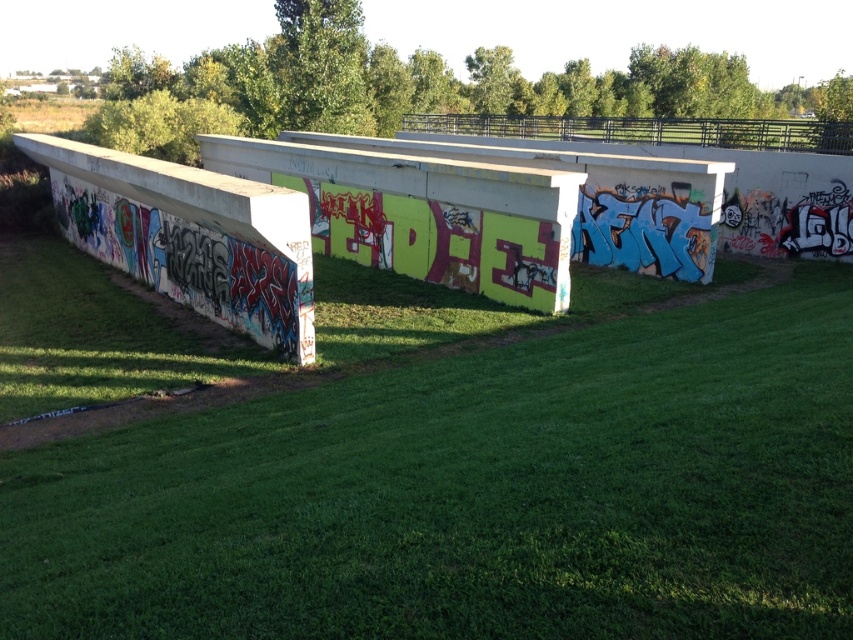
You are a maintenance worker needing to cross from the green grass at center to the concreteroughbridge at left. Given that your equipment is 6 meters long, will it fit between them?

The distance between the green grass at center and the concreteroughbridge at left is 5.66 meters, so the equipment which is 6 meters long will not fit between them as it is longer than the available space.

You are standing in front of the concrete structure with graffiti and want to take a photo. You notice two points marked on the concrete surface at coordinates point (86,275) and point (190,305). Which point is closer to your camera when taking the photo?

Point (190,305) is closer to the camera because it is less further away than point (86,275), which is further to the camera.

You are standing on the green grass at center and want to reach the concreteroughbridge at left. Which direction should you move to get there?

The green grass at center is below the concreteroughbridge at left, so you should move upward to reach the concreteroughbridge at left.